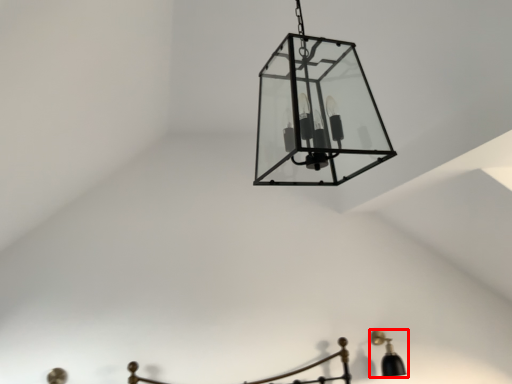
Question: From the image's perspective, where is lamp (annotated by the red box) located in relation to lamp in the image?

Choices:
 (A) below
 (B) above

Answer: (A)